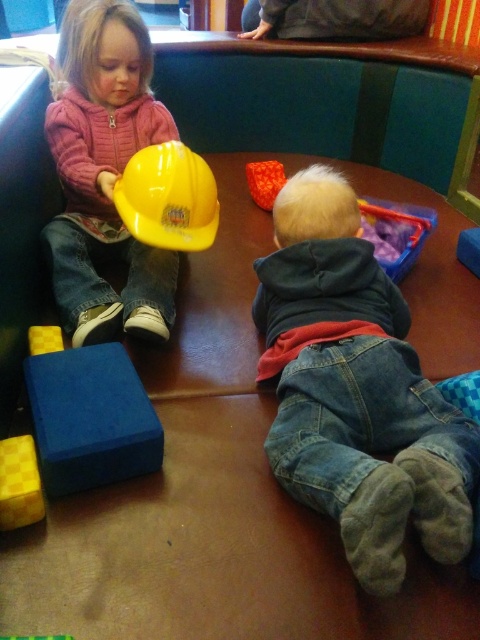
Is denim jeans at lower right taller than rubber yellow construction helmet at upper left?

Yes.

Where is `denim jeans at lower right`? The height and width of the screenshot is (640, 480). denim jeans at lower right is located at coordinates 356,390.

Find the location of `denim jeans at lower right`. denim jeans at lower right is located at coordinates (356, 390).

Is point (252, 173) in front of point (64, 637)?

No, it is behind (64, 637).

Is point (276, 170) positioned after point (69, 636)?

Yes, it is.

This screenshot has height=640, width=480. In order to click on orange fabric toy at center in this screenshot , I will do `click(264, 180)`.

Which is in front, point (361, 278) or point (36, 330)?

Positioned in front is point (361, 278).

Is denim jeans at lower right above rubber yellow block at lower left?

No, denim jeans at lower right is not above rubber yellow block at lower left.

Is point (344, 321) in front of point (55, 337)?

Yes, point (344, 321) is in front of point (55, 337).

Where is `denim jeans at lower right`? This screenshot has width=480, height=640. denim jeans at lower right is located at coordinates (356, 390).